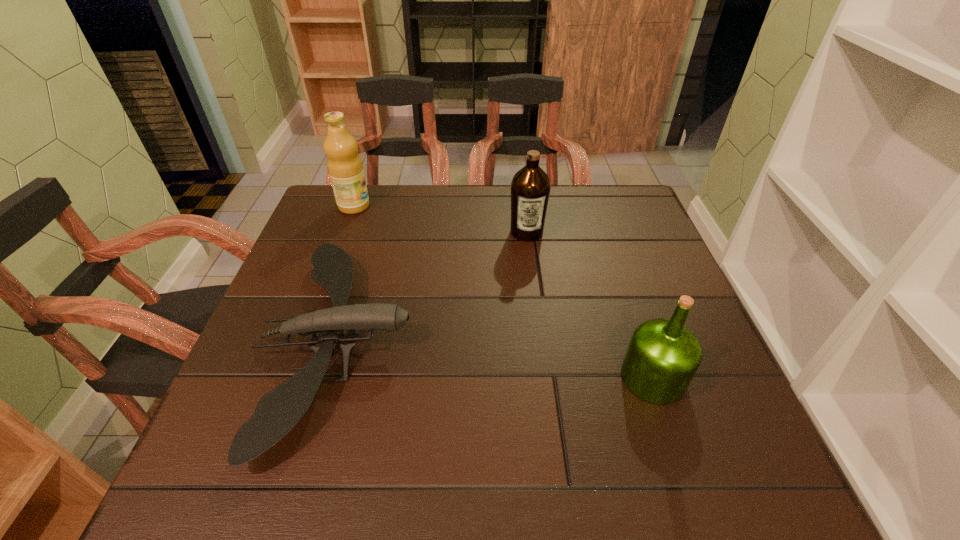
Locate an element on the screen. The height and width of the screenshot is (540, 960). the farthest object is located at coordinates (345, 168).

I want to click on the farthest olive oil, so click(x=345, y=168).

This screenshot has height=540, width=960. I want to click on the third nearest object, so click(530, 188).

This screenshot has height=540, width=960. I want to click on the second farthest olive oil, so click(530, 188).

You are a GUI agent. You are given a task and a screenshot of the screen. Output one action in this format:
    pyautogui.click(x=<x>, y=<y>)
    Task: Click on the nearest olive oil
    
    Given the screenshot: What is the action you would take?
    pyautogui.click(x=663, y=355)

Identify the location of the rightmost olive oil. Image resolution: width=960 pixels, height=540 pixels. [x=663, y=355].

You are a GUI agent. You are given a task and a screenshot of the screen. Output one action in this format:
    pyautogui.click(x=<x>, y=<y>)
    Task: Click on the drone
    The width and height of the screenshot is (960, 540).
    Given the screenshot: What is the action you would take?
    pyautogui.click(x=277, y=412)

Identify the location of vacant region located on the label of the farthest object. This screenshot has height=540, width=960. (478, 206).

Locate an element on the screen. blank area located 0.120m on the label of the second nearest olive oil is located at coordinates (532, 274).

Where is `free spot located on the back of the nearest olive oil`? free spot located on the back of the nearest olive oil is located at coordinates (631, 313).